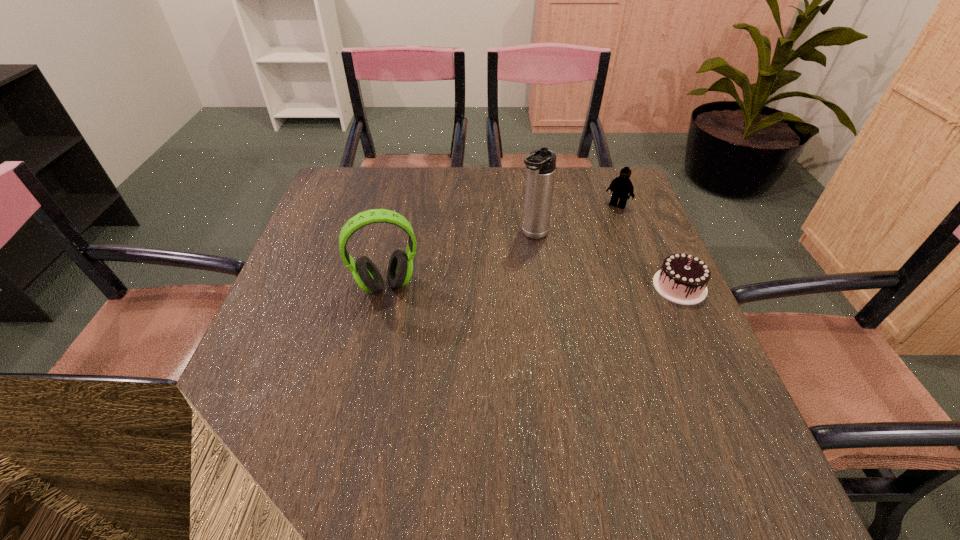
Where is `vacant space located 0.240m on the face of the second shortest object`? The image size is (960, 540). vacant space located 0.240m on the face of the second shortest object is located at coordinates click(578, 257).

I want to click on free location located 0.300m on the face of the second shortest object, so [567, 271].

The height and width of the screenshot is (540, 960). I want to click on blank area located 0.050m on the handle side of the thermos bottle, so click(x=516, y=256).

The height and width of the screenshot is (540, 960). Find the location of `vacant space situated 0.220m on the handle side of the thermos bottle`. vacant space situated 0.220m on the handle side of the thermos bottle is located at coordinates (481, 298).

In order to click on blank space located on the handle side of the thermos bottle in this screenshot , I will do `click(501, 275)`.

Identify the location of object present at the far edge. This screenshot has height=540, width=960. (621, 186).

In order to click on object located at the left edge in this screenshot , I will do `click(367, 276)`.

This screenshot has width=960, height=540. I want to click on chocolate cake at the right edge, so coord(683,279).

Find the location of a particular element. The height and width of the screenshot is (540, 960). Lego at the right edge is located at coordinates (621, 186).

The image size is (960, 540). In order to click on object present at the far right corner in this screenshot , I will do `click(621, 186)`.